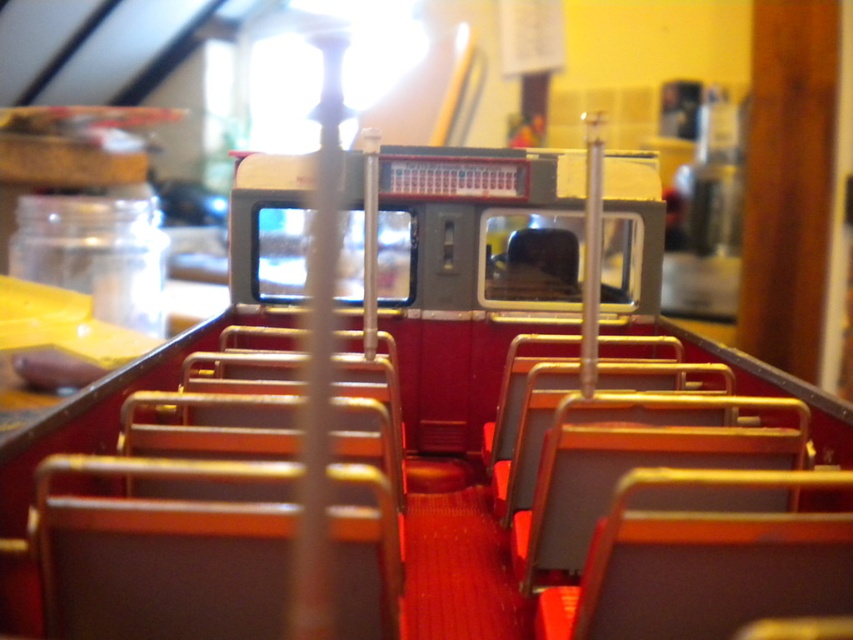
You are sitting in the driver seat of the bus and looking towards the passengers. Which chair is on the right side between the brown leather chair at center and the metallic gold chair at center?

The brown leather chair at center is on the right side of the metallic gold chair at center, so the brown leather chair at center is on the right.

You are a passenger in the bus and want to sit down. You see a matte brown chair at center and a metallic gray seat at center. Which seat is closer to you to sit on?

The matte brown chair at center is closer to the viewer than the metallic gray seat at center, so you can sit on the matte brown chair at center first as it is nearer.

You are a toy designer trying to fit a new accessory between the metallic gray seat at center and the metallic red chair at center in the bus model. The accessory requires 5 inches of space. Can it fit?

The distance between the metallic gray seat at center and the metallic red chair at center is 4.46 inches, which is less than the required 5 inches. The accessory cannot fit in the available space.